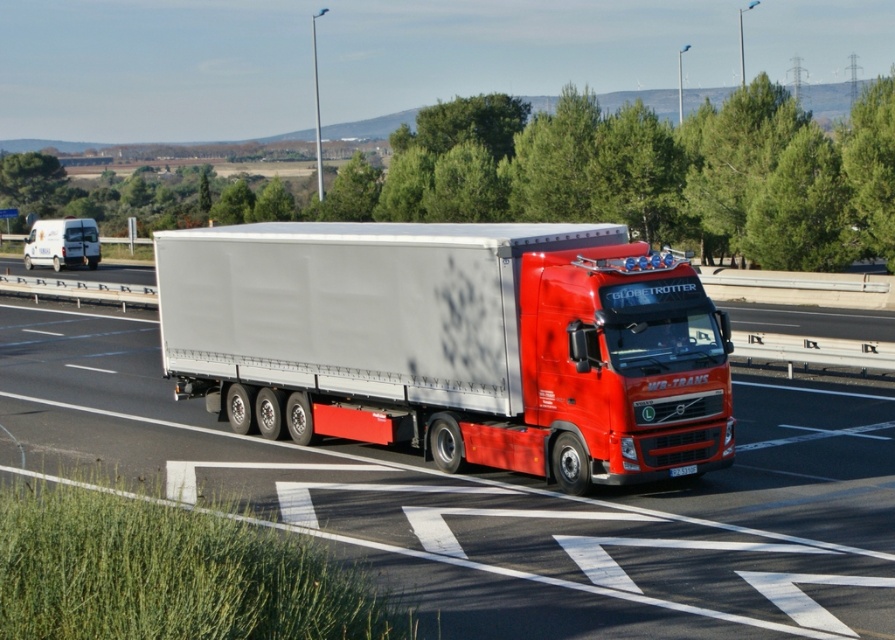
Question: Which object appears farthest from the camera in this image?

Choices:
 (A) white matte trailer truck at center
 (B) matte white trailer at center
 (C) black plastic license plate at center
 (D) white matte van at left

Answer: (D)

Question: Is matte white trailer at center above black plastic license plate at center?

Choices:
 (A) no
 (B) yes

Answer: (B)

Question: Can you confirm if white matte trailer truck at center is thinner than black plastic license plate at center?

Choices:
 (A) no
 (B) yes

Answer: (A)

Question: Which of these objects is positioned farthest from the black plastic license plate at center?

Choices:
 (A) white matte van at left
 (B) white matte trailer truck at center
 (C) matte white trailer at center

Answer: (A)

Question: Can you confirm if white matte van at left is positioned to the left of black plastic license plate at center?

Choices:
 (A) no
 (B) yes

Answer: (B)

Question: Among these objects, which one is nearest to the camera?

Choices:
 (A) white matte van at left
 (B) matte white trailer at center
 (C) white matte trailer truck at center

Answer: (B)